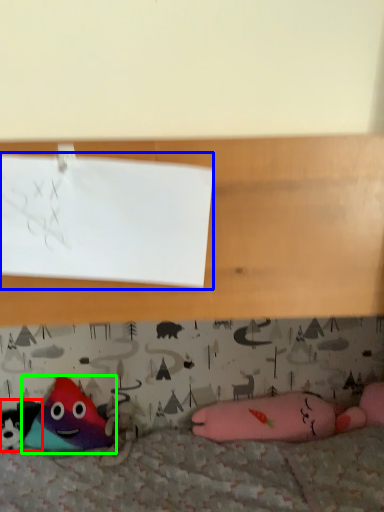
Question: Estimate the real-world distances between objects in this image. Which object is farther from toy (highlighted by a red box), paper (highlighted by a blue box) or toy (highlighted by a green box)?

Choices:
 (A) paper
 (B) toy

Answer: (A)